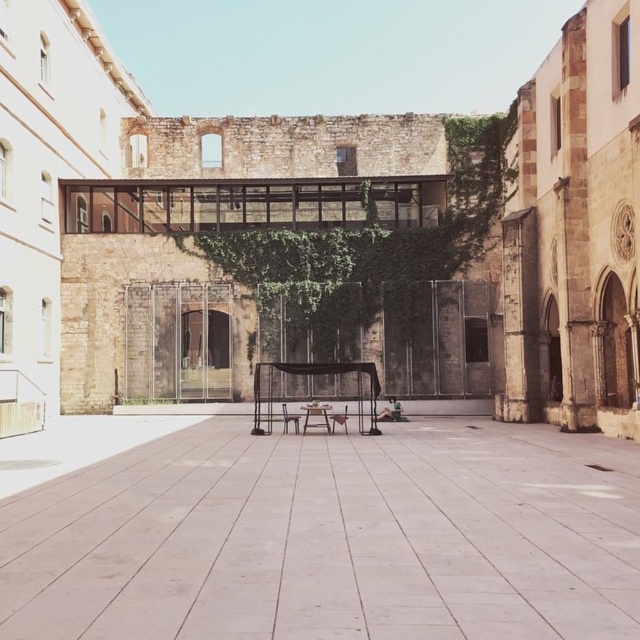
Question: Is white concrete alley at center wider than wooden park bench at center?

Choices:
 (A) yes
 (B) no

Answer: (A)

Question: Which of the following is the farthest from the observer?

Choices:
 (A) (573, 451)
 (B) (282, 404)

Answer: (B)

Question: Does white concrete alley at center appear under wooden park bench at center?

Choices:
 (A) no
 (B) yes

Answer: (A)

Question: Can you confirm if white concrete alley at center is thinner than wooden park bench at center?

Choices:
 (A) yes
 (B) no

Answer: (B)